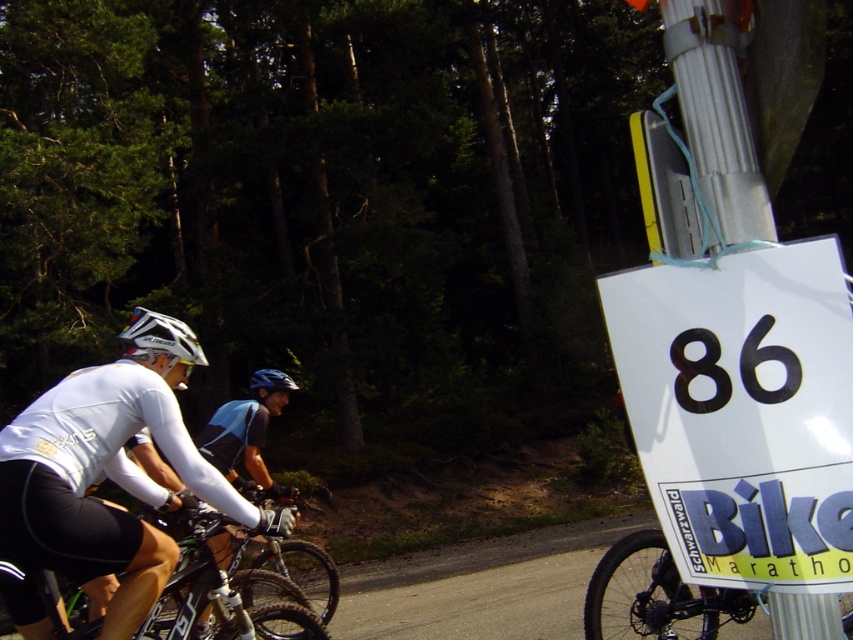
Between silver metallic bicycle at right and blackmaterial/texturenumber at right, which one is positioned higher?

A: Positioned higher is blackmaterial/texturenumber at right.

What do you see at coordinates (654, 595) in the screenshot? The height and width of the screenshot is (640, 853). I see `silver metallic bicycle at right` at bounding box center [654, 595].

Which is behind, point (669, 563) or point (744, 369)?

The point (669, 563) is more distant.

I want to click on silver metallic bicycle at right, so click(654, 595).

Measure the distance between point (199, 513) and camera.

The distance of point (199, 513) from camera is 11.43 feet.

The height and width of the screenshot is (640, 853). I want to click on green matte bicycle at center, so click(221, 593).

This screenshot has width=853, height=640. What are the coordinates of `green matte bicycle at center` in the screenshot? It's located at (221, 593).

Is silver metallic pole at right further to the viewer compared to blackmaterial/texturenumber at right?

No, silver metallic pole at right is in front of blackmaterial/texturenumber at right.

Does point (718, 76) come behind point (770, 396)?

Yes, it is behind point (770, 396).

Image resolution: width=853 pixels, height=640 pixels. I want to click on silver metallic pole at right, so click(717, 115).